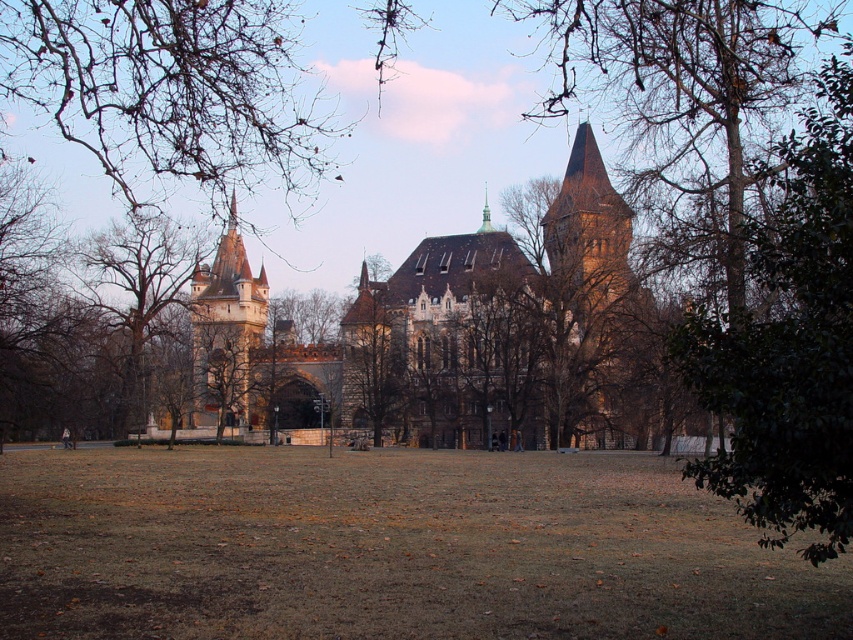
Question: Is brown stone church at center smaller than brown leafless tree at left?

Choices:
 (A) no
 (B) yes

Answer: (A)

Question: Based on their relative distances, which object is farther from the brown stone church at center?

Choices:
 (A) smooth gold spire at upper center
 (B) green leafy tree at right
 (C) brown leafless tree at left
 (D) brown stone tower at center

Answer: (B)

Question: Which point appears closest to the camera in this image?

Choices:
 (A) (397, 326)
 (B) (202, 269)

Answer: (A)

Question: Can you confirm if brown stone church at center is positioned to the right of golden stone tower at center?

Choices:
 (A) no
 (B) yes

Answer: (B)

Question: Which point is closer to the camera taking this photo?

Choices:
 (A) (480, 220)
 (B) (233, 300)
 (C) (515, 324)
 (D) (566, 294)

Answer: (D)

Question: Does green leafy tree at right appear under brown leafless tree at left?

Choices:
 (A) no
 (B) yes

Answer: (A)